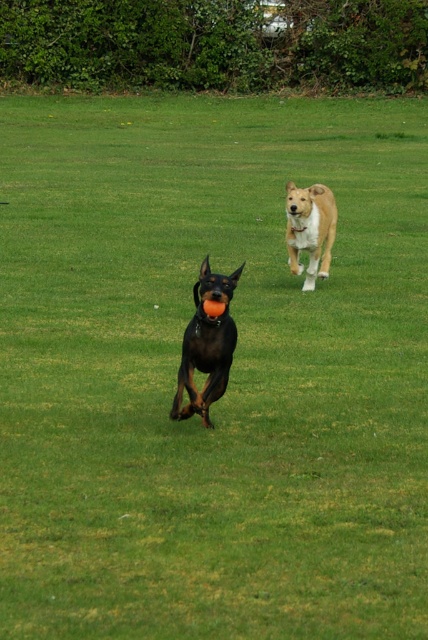
Question: Can you confirm if shiny black dog at center is positioned above light brown fur at center?

Choices:
 (A) no
 (B) yes

Answer: (A)

Question: Does shiny black dog at center have a greater width compared to light brown fur at center?

Choices:
 (A) yes
 (B) no

Answer: (B)

Question: Which point is closer to the camera?

Choices:
 (A) shiny black dog at center
 (B) light brown fur at center

Answer: (A)

Question: Is shiny black dog at center further to camera compared to light brown fur at center?

Choices:
 (A) no
 (B) yes

Answer: (A)